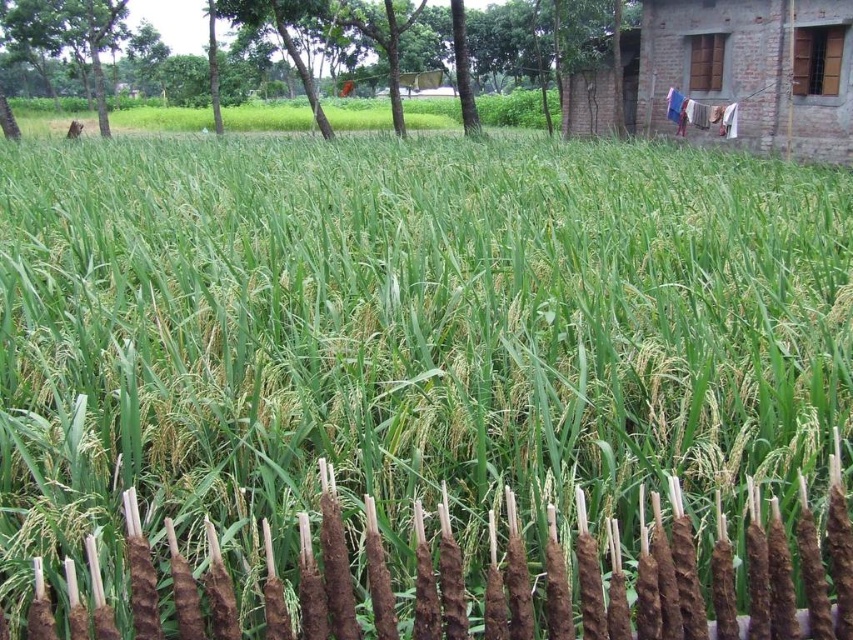
In the scene shown: Does brown brick hut at upper right have a smaller size compared to green leafy tree at upper center?

Yes.

Is brown brick hut at upper right positioned in front of green leafy tree at upper center?

Yes.

Image resolution: width=853 pixels, height=640 pixels. What do you see at coordinates (728, 74) in the screenshot?
I see `brown brick hut at upper right` at bounding box center [728, 74].

You are a GUI agent. You are given a task and a screenshot of the screen. Output one action in this format:
    pyautogui.click(x=<x>, y=<y>)
    Task: Click on the brown brick hut at upper right
    The height and width of the screenshot is (640, 853).
    Given the screenshot: What is the action you would take?
    pyautogui.click(x=728, y=74)

Does brown clay fence at lower center have a greater height compared to green leafy tree at upper center?

In fact, brown clay fence at lower center may be shorter than green leafy tree at upper center.

What do you see at coordinates (720, 573) in the screenshot? The image size is (853, 640). I see `brown clay fence at lower center` at bounding box center [720, 573].

Identify the location of brown clay fence at lower center. This screenshot has width=853, height=640. (720, 573).

Between brown clay fence at lower center and brown brick hut at upper right, which one is positioned higher?

Positioned higher is brown brick hut at upper right.

Is brown clay fence at lower center to the right of brown brick hut at upper right from the viewer's perspective?

No, brown clay fence at lower center is not to the right of brown brick hut at upper right.

What do you see at coordinates (720, 573) in the screenshot?
I see `brown clay fence at lower center` at bounding box center [720, 573].

The height and width of the screenshot is (640, 853). What are the coordinates of `brown clay fence at lower center` in the screenshot? It's located at (720, 573).